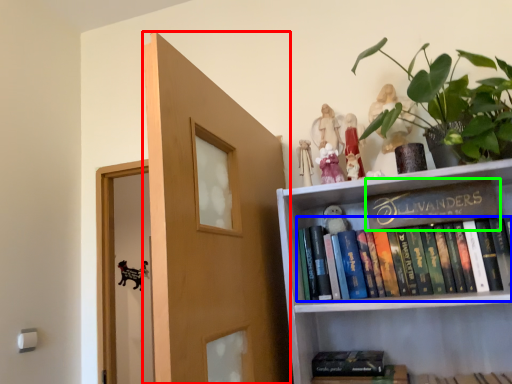
Question: Which object is the closest to the door (highlighted by a red box)? Choose among these: book (highlighted by a blue box) or book (highlighted by a green box).

Choices:
 (A) book
 (B) book

Answer: (A)